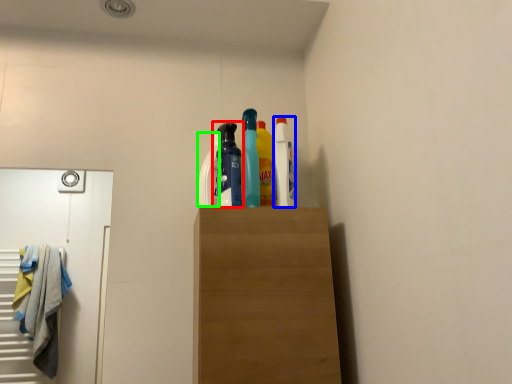
Question: Considering the real-world distances, which object is farthest from bottle (highlighted by a red box)? cleaning product (highlighted by a blue box) or cleaning product (highlighted by a green box)?

Choices:
 (A) cleaning product
 (B) cleaning product

Answer: (A)